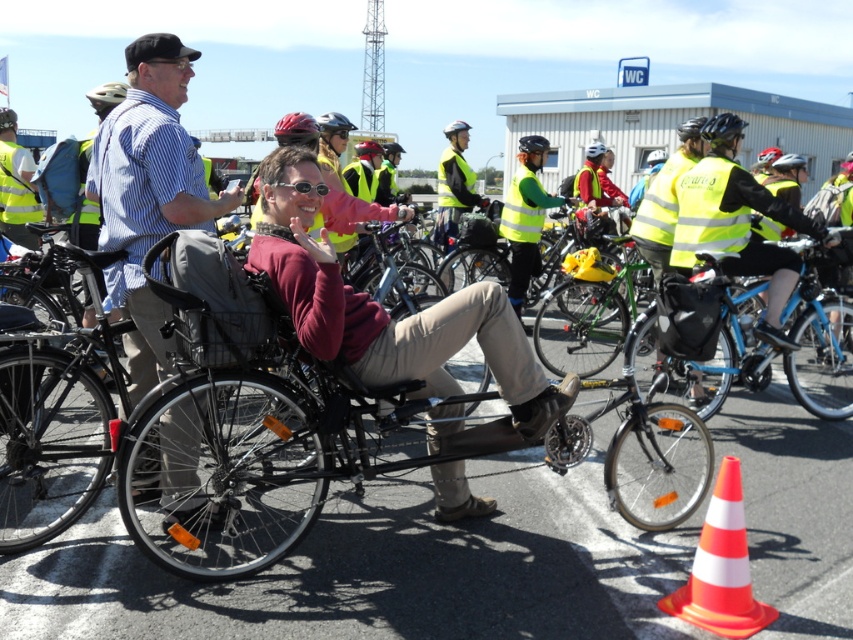
You are standing in the cycling event scene and want to place a small flag at the point closer to you between point [799,296] and point [346,132]. Which point should you choose?

You should choose point [799,296] because it is closer to the viewer than point [346,132].